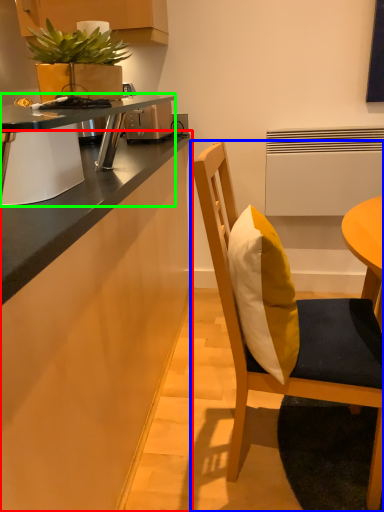
Question: Considering the real-world distances, which object is farthest from cabinetry (highlighted by a red box)? chair (highlighted by a blue box) or desk (highlighted by a green box)?

Choices:
 (A) chair
 (B) desk

Answer: (A)